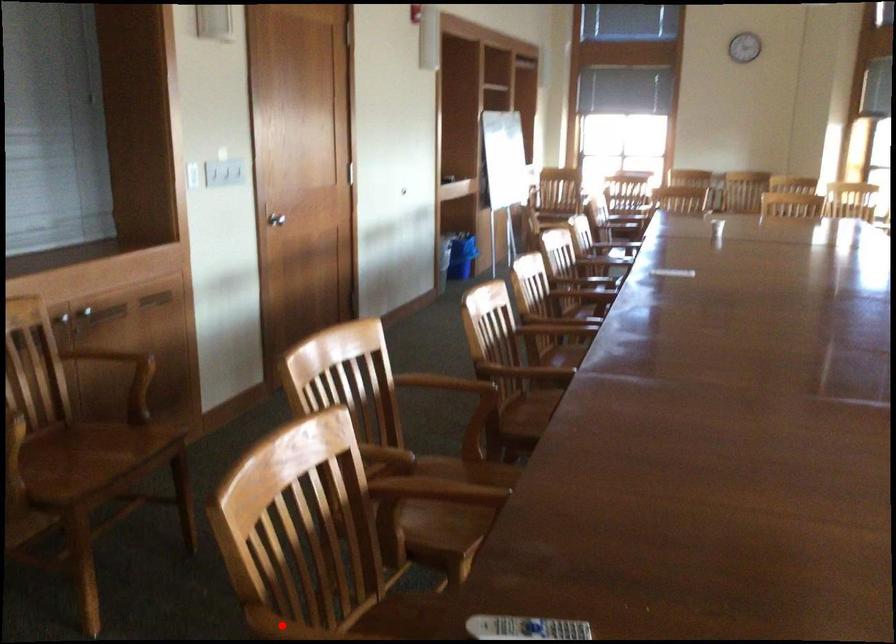
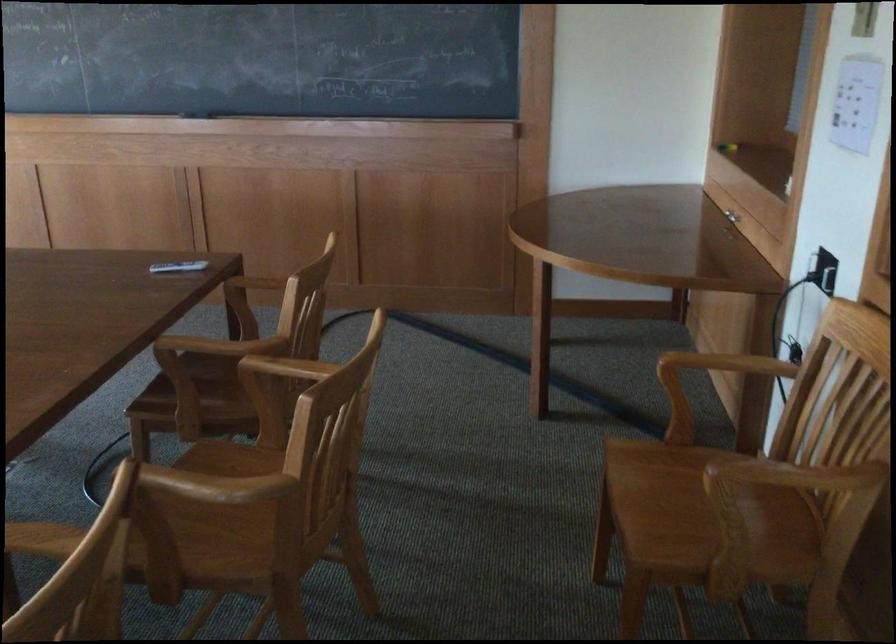
Question: I am providing you with two images of the same scene from different viewpoints. A red point is marked on the first image. Is the red point's position out of view in image 2?

Choices:
 (A) Yes
 (B) No

Answer: (A)